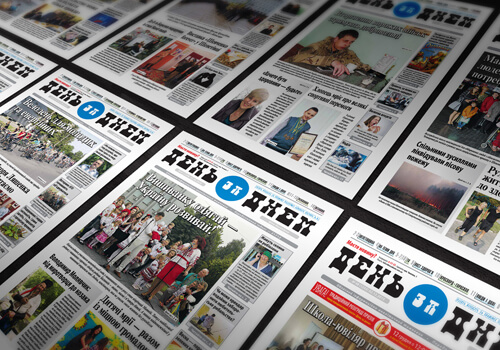
Find the location of a particular element. The image size is (500, 350). newspapers arranged in a neat grid is located at coordinates (13, 64), (56, 28), (41, 123), (153, 57), (167, 223), (338, 96), (357, 281), (440, 179).